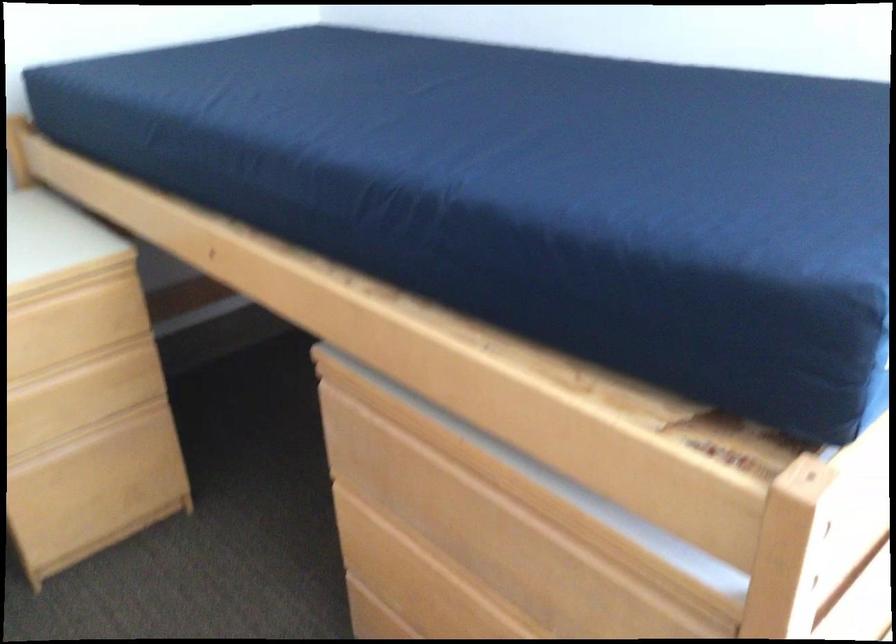
The first image is from the beginning of the video and the second image is from the end. How did the camera likely rotate when shooting the video?

The camera rotated toward left-down.